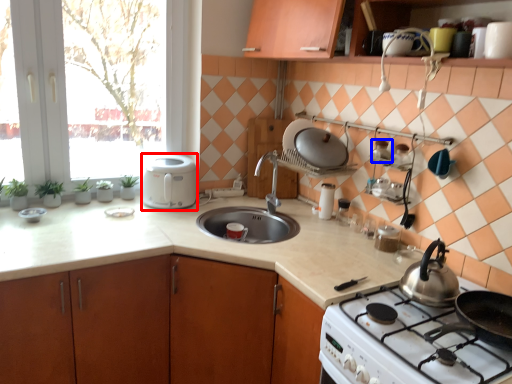
Question: Which of the following is the farthest to the observer, kitchen appliance (highlighted by a red box) or appliance (highlighted by a blue box)?

Choices:
 (A) kitchen appliance
 (B) appliance

Answer: (A)